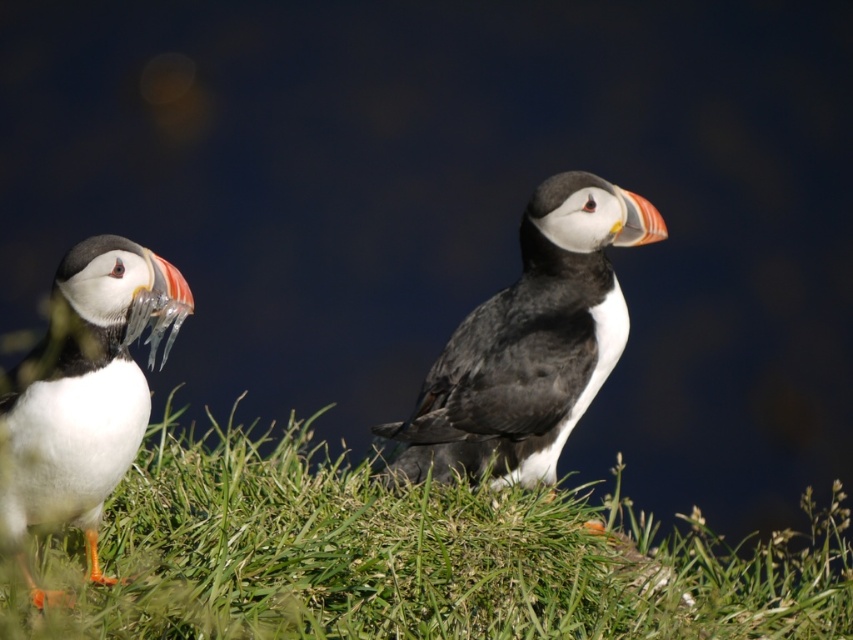
Does green grass at center have a greater height compared to black matte puffin at center?

No, green grass at center is not taller than black matte puffin at center.

Does green grass at center have a greater width compared to black matte puffin at center?

Indeed, green grass at center has a greater width compared to black matte puffin at center.

Is point (732, 577) closer to viewer compared to point (503, 326)?

No, (732, 577) is further to viewer.

This screenshot has height=640, width=853. I want to click on green grass at center, so click(x=415, y=556).

Between black matte puffin at center and white matte bird at left, which one appears on the right side from the viewer's perspective?

From the viewer's perspective, black matte puffin at center appears more on the right side.

The image size is (853, 640). What do you see at coordinates (531, 342) in the screenshot?
I see `black matte puffin at center` at bounding box center [531, 342].

This screenshot has height=640, width=853. Find the location of `black matte puffin at center`. black matte puffin at center is located at coordinates (531, 342).

Is green grass at center bigger than white matte bird at left?

Yes, green grass at center is bigger than white matte bird at left.

Is point (28, 632) positioned in front of point (26, 406)?

That is False.

What do you see at coordinates (415, 556) in the screenshot?
I see `green grass at center` at bounding box center [415, 556].

At what (x,y) coordinates should I click in order to perform the action: click on green grass at center. Please return your answer as a coordinate pair (x, y). The height and width of the screenshot is (640, 853). Looking at the image, I should click on (x=415, y=556).